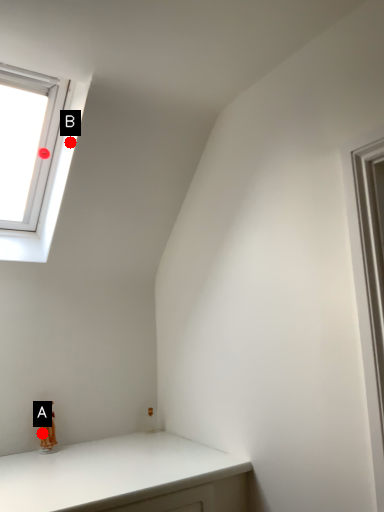
Question: Two points are circled on the image, labeled by A and B beside each circle. Which point is farther to the camera?

Choices:
 (A) A is further
 (B) B is further

Answer: (A)